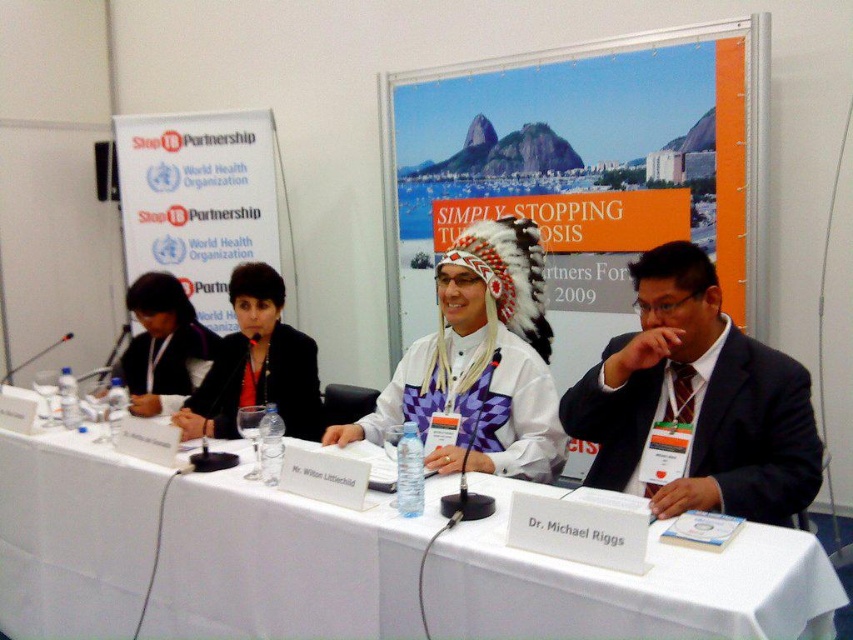
Question: Among these objects, which one is farthest from the camera?

Choices:
 (A) black suit at right
 (B) white fabric table at center
 (C) matte black jacket at upper left

Answer: (C)

Question: Considering the relative positions of white fabric table at center and black fabric jacket at upper left in the image provided, where is white fabric table at center located with respect to black fabric jacket at upper left?

Choices:
 (A) right
 (B) left

Answer: (A)

Question: In this image, where is white fabric table at center located relative to black suit at right?

Choices:
 (A) right
 (B) left

Answer: (B)

Question: Estimate the real-world distances between objects in this image. Which object is closer to the black fabric jacket at upper left?

Choices:
 (A) white feather headdress at center
 (B) white fabric table at center
 (C) black suit at right
 (D) matte black jacket at upper left

Answer: (D)

Question: Which object is positioned farthest from the matte black jacket at upper left?

Choices:
 (A) white fabric table at center
 (B) white feather headdress at center
 (C) black suit at right

Answer: (C)

Question: Is white fabric table at center positioned before matte black jacket at upper left?

Choices:
 (A) no
 (B) yes

Answer: (B)